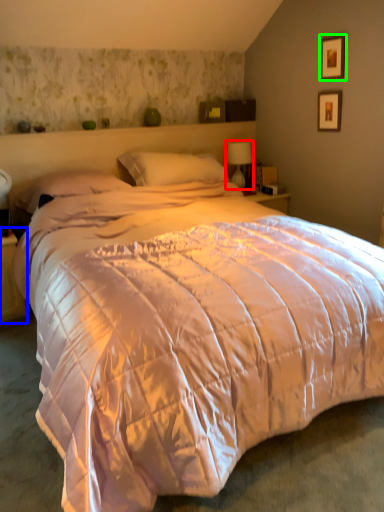
Question: Which object is the closest to the table lamp (highlighted by a red box)? Choose among these: nightstand (highlighted by a blue box) or picture frame (highlighted by a green box).

Choices:
 (A) nightstand
 (B) picture frame

Answer: (B)